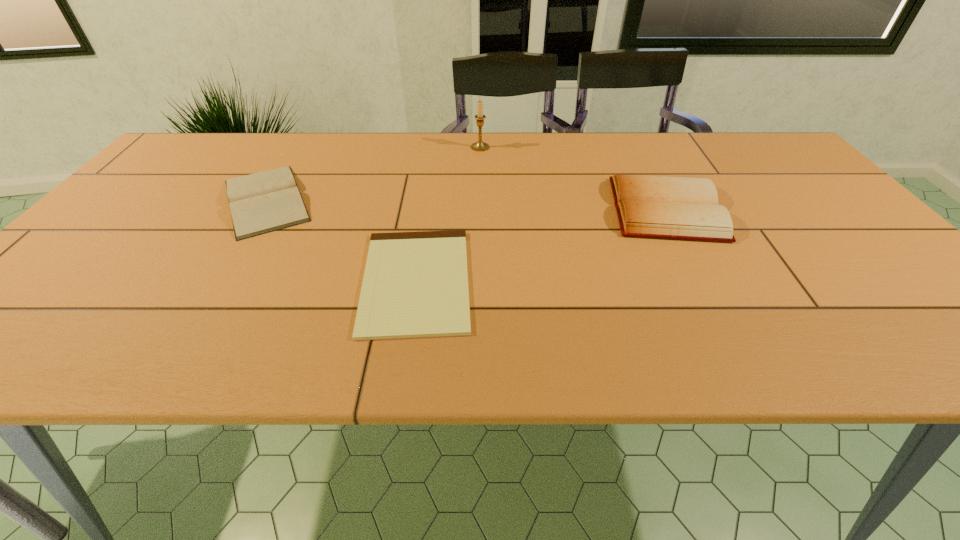
The height and width of the screenshot is (540, 960). I want to click on candle holder, so click(480, 145).

Locate an element on the screen. the tallest object is located at coordinates (480, 145).

Image resolution: width=960 pixels, height=540 pixels. In order to click on the right Bible in this screenshot , I will do `click(683, 208)`.

Where is `the third shortest object`? the third shortest object is located at coordinates (683, 208).

At what (x,y) coordinates should I click in order to perform the action: click on the leftmost object. Please return your answer as a coordinate pair (x, y). The height and width of the screenshot is (540, 960). Looking at the image, I should click on (263, 202).

The image size is (960, 540). In order to click on the third tallest object in this screenshot , I will do `click(263, 202)`.

The image size is (960, 540). I want to click on clipboard, so click(415, 285).

Identify the location of vacant space located on the right of the tallest object. (513, 147).

The height and width of the screenshot is (540, 960). What are the coordinates of `vacant space located on the back of the right Bible` in the screenshot? It's located at (629, 137).

Where is `vacant region located 0.130m on the front of the left Bible`? The image size is (960, 540). vacant region located 0.130m on the front of the left Bible is located at coordinates (216, 281).